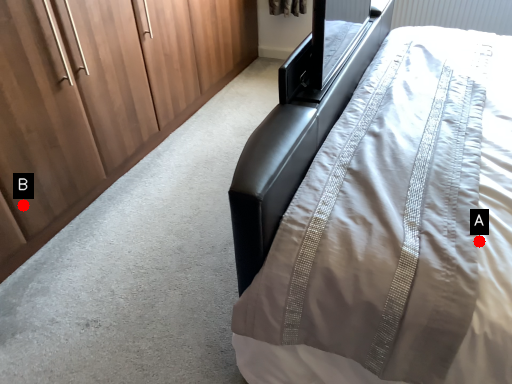
Question: Two points are circled on the image, labeled by A and B beside each circle. Which point is farther to the camera?

Choices:
 (A) A is further
 (B) B is further

Answer: (B)